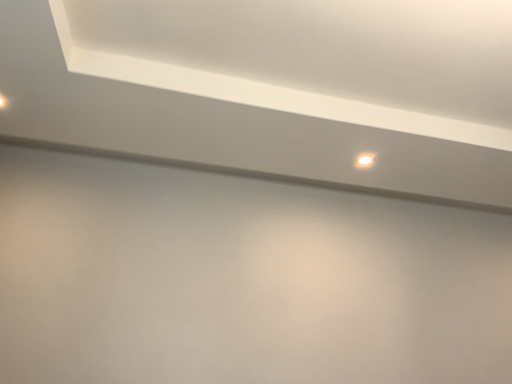
You are a GUI agent. You are given a task and a screenshot of the screen. Output one action in this format:
    pyautogui.click(x=<x>, y=<y>)
    Task: Click on the white glossy light at upper center
    The image size is (512, 384).
    Given the screenshot: What is the action you would take?
    pyautogui.click(x=365, y=160)

Describe the element at coordinates (365, 160) in the screenshot. I see `white glossy light at upper center` at that location.

In order to face white glossy light at upper center, should I rotate leftwards or rightwards?

To face it directly, rotate right by 14.600 degrees.

Based on the photo, measure the distance between white glossy light at upper center and camera.

white glossy light at upper center is 6.07 feet away from camera.

Image resolution: width=512 pixels, height=384 pixels. I want to click on white glossy light at upper center, so click(365, 160).